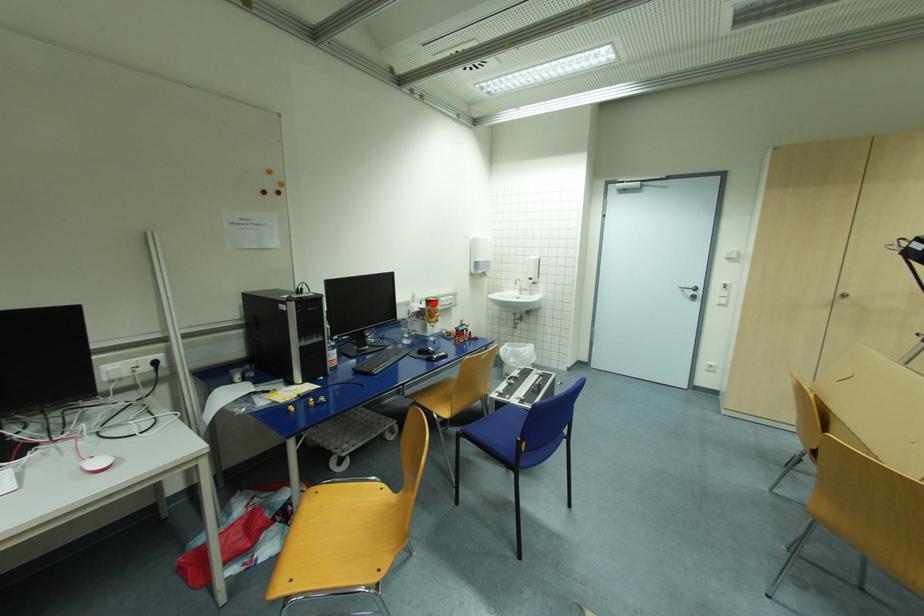
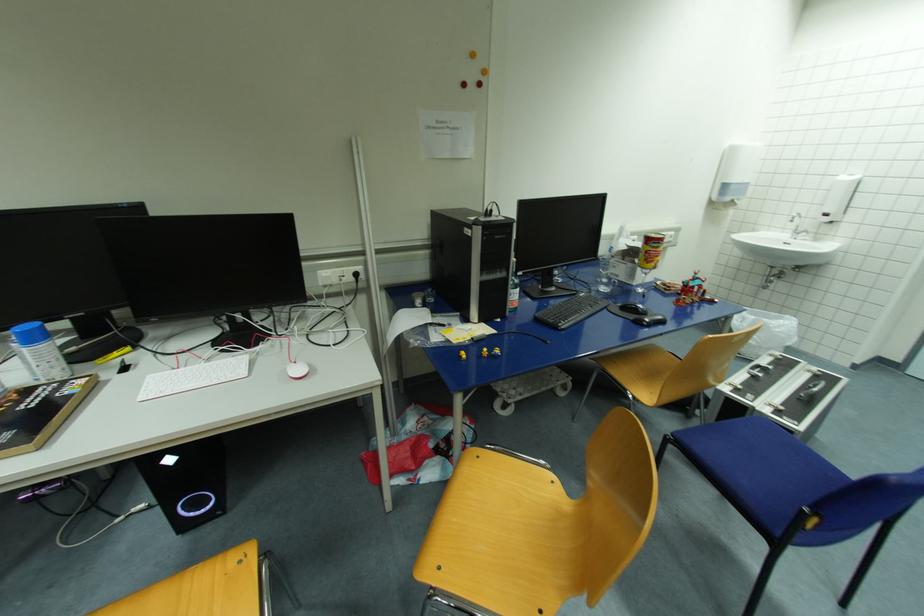
The point at the highlighted location is marked in the first image. Where is the corresponding point in the second image?

(653, 241)